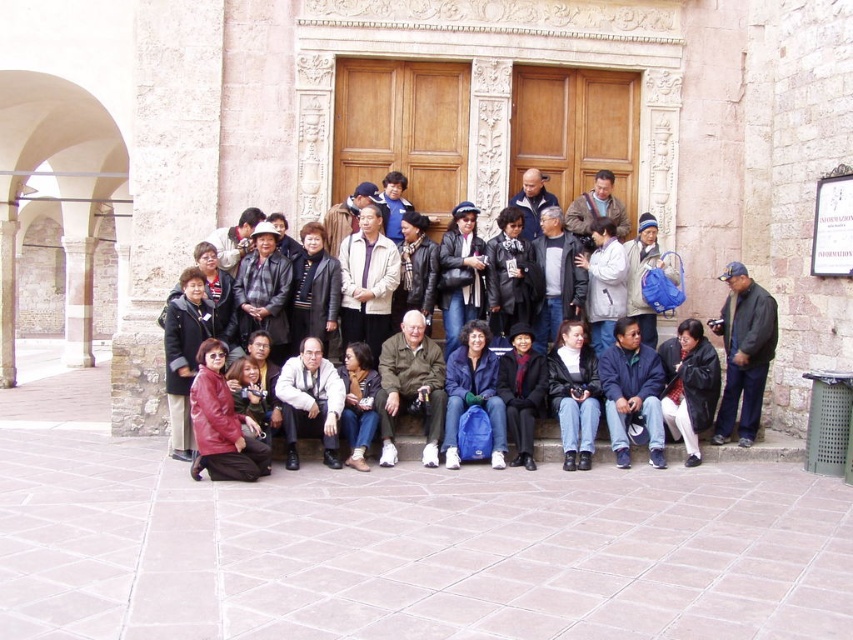
You are a photographer trying to frame a shot of the group. You need to place a focus point at the location of the black leather jacket at lower center. What are the coordinates where you should place the focus point?

The coordinates for the black leather jacket at lower center are at point (689,385).

You are standing in front of the large wooden door and want to touch both the point at coordinates (x=753, y=328) and the point at coordinates (x=657, y=424). Which point should you reach for first?

You should reach for point (x=753, y=328) first because it is closer to you than point (x=657, y=424), which is further away.

You are standing in front of the large wooden door and want to greet both the person wearing the matte black jacket at center and the person wearing the light brown leather jacket at center. Which jacket should you approach first if you want to greet them in order from left to right?

You should first greet the person wearing the light brown leather jacket at center because it is positioned to the left of the matte black jacket at center.